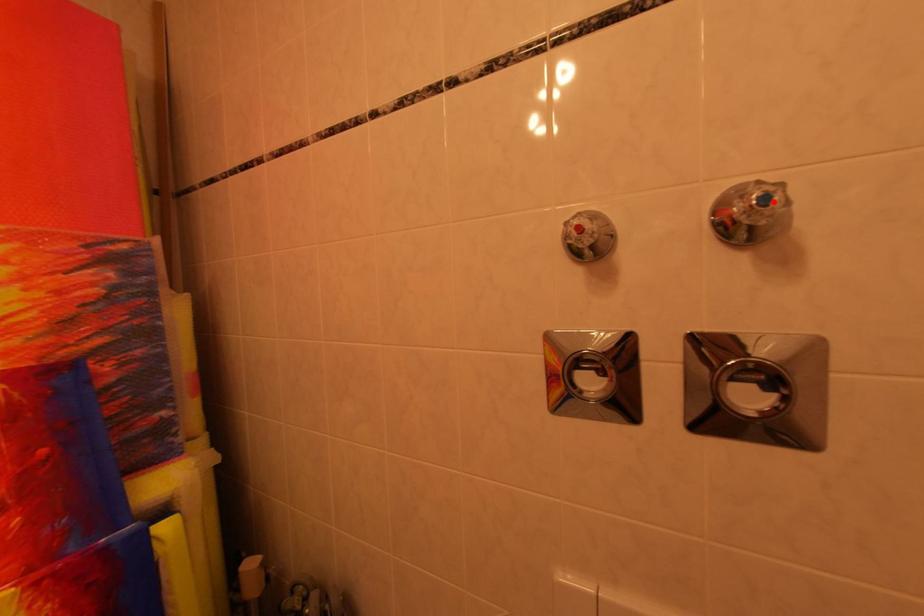
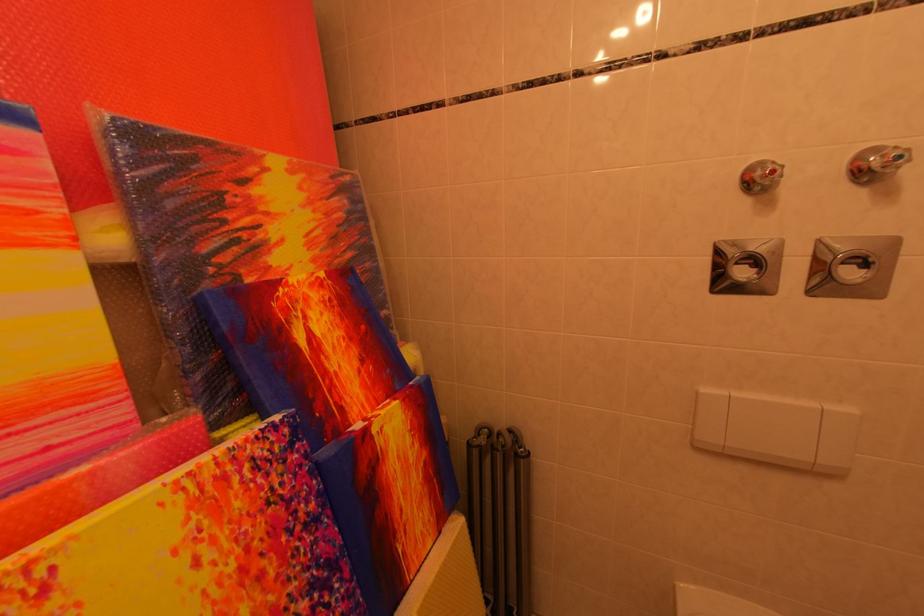
In the second image, find the point that corresponds to the highlighted location in the first image.

(907, 161)